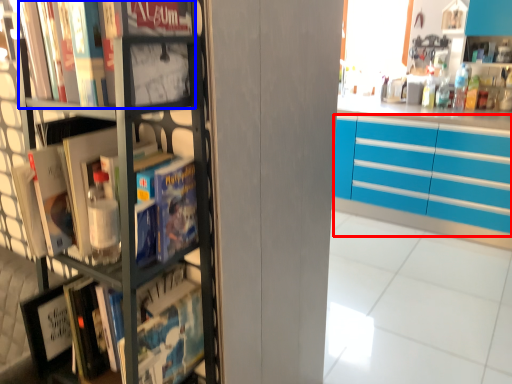
Question: Which point is closer to the camera, cabinetry (highlighted by a red box) or book (highlighted by a blue box)?

Choices:
 (A) cabinetry
 (B) book

Answer: (B)